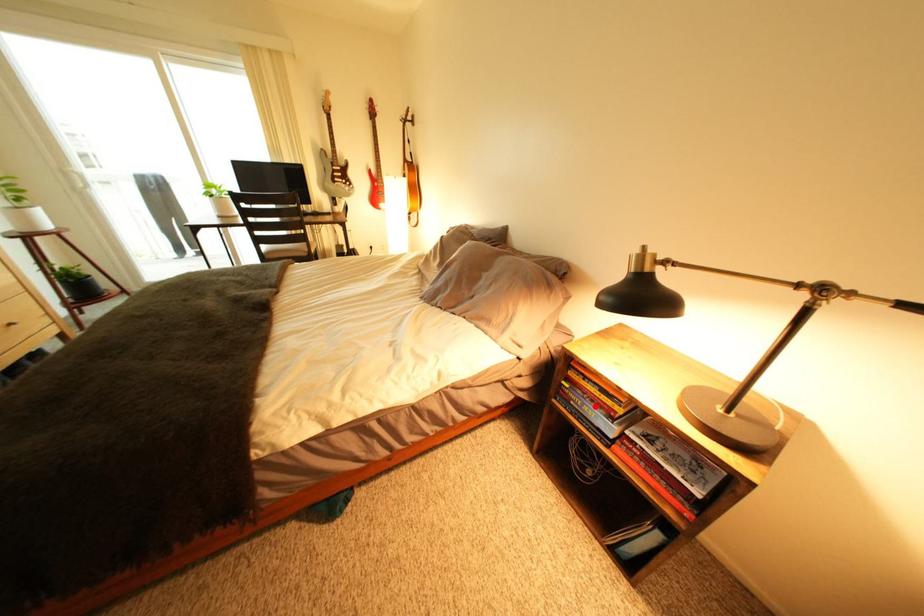
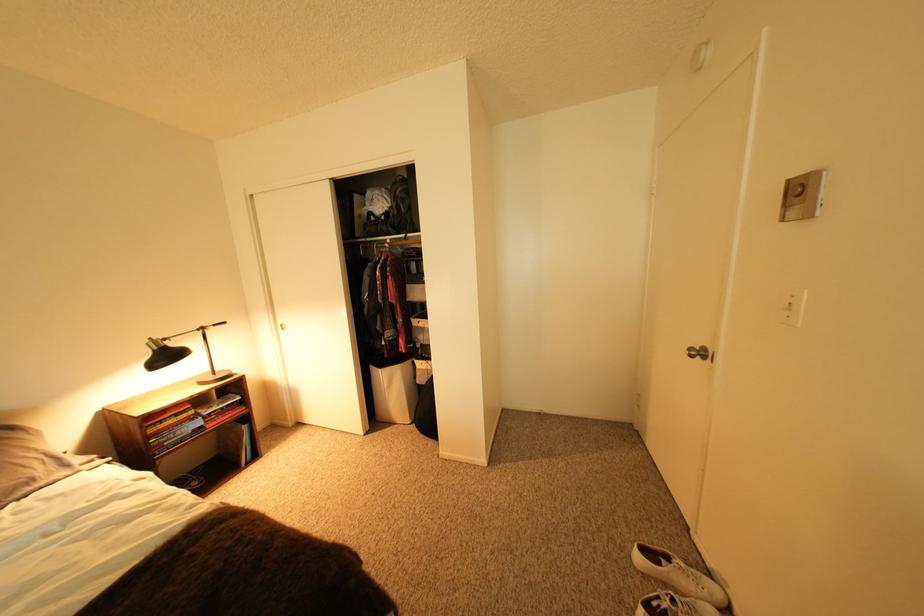
Question: I am providing you with two images of the same scene from different viewpoints. In image1, a red point is highlighted. Considering the same 3D point in image2, which of the following is correct?

Choices:
 (A) It is closer
 (B) It is farther

Answer: (A)